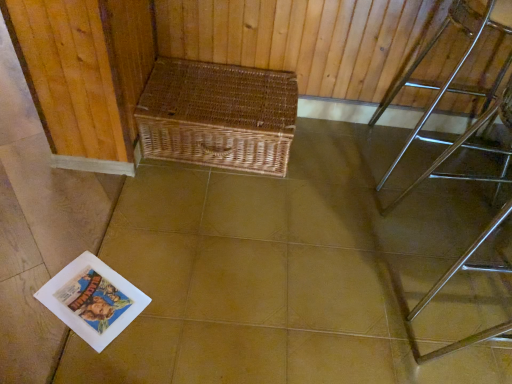
Question: Should I look upward or downward to see polished chrome table at right?

Choices:
 (A) up
 (B) down

Answer: (A)

Question: Could woven brown picnic basket at center be considered to be inside woven wicker basket at upper center?

Choices:
 (A) yes
 (B) no

Answer: (B)

Question: Does woven wicker basket at upper center have a lesser width compared to woven brown picnic basket at center?

Choices:
 (A) yes
 (B) no

Answer: (B)

Question: Could you tell me if woven wicker basket at upper center is facing woven brown picnic basket at center?

Choices:
 (A) no
 (B) yes

Answer: (A)

Question: Is woven wicker basket at upper center shorter than woven brown picnic basket at center?

Choices:
 (A) yes
 (B) no

Answer: (A)

Question: From a real-world perspective, does woven wicker basket at upper center stand above woven brown picnic basket at center?

Choices:
 (A) yes
 (B) no

Answer: (B)

Question: Is woven wicker basket at upper center outside of woven brown picnic basket at center?

Choices:
 (A) yes
 (B) no

Answer: (A)

Question: Could you tell me if polished chrome table at right is turned towards woven wicker basket at upper center?

Choices:
 (A) no
 (B) yes

Answer: (A)

Question: Does polished chrome table at right appear on the right side of woven wicker basket at upper center?

Choices:
 (A) no
 (B) yes

Answer: (B)

Question: Can you confirm if polished chrome table at right is shorter than woven wicker basket at upper center?

Choices:
 (A) yes
 (B) no

Answer: (B)

Question: Are polished chrome table at right and woven wicker basket at upper center located far from each other?

Choices:
 (A) no
 (B) yes

Answer: (A)

Question: Does polished chrome table at right lie in front of woven wicker basket at upper center?

Choices:
 (A) yes
 (B) no

Answer: (A)

Question: Is polished chrome table at right touching woven wicker basket at upper center?

Choices:
 (A) no
 (B) yes

Answer: (A)

Question: From the image's perspective, does woven brown picnic basket at center appear lower than polished chrome table at right?

Choices:
 (A) yes
 (B) no

Answer: (A)